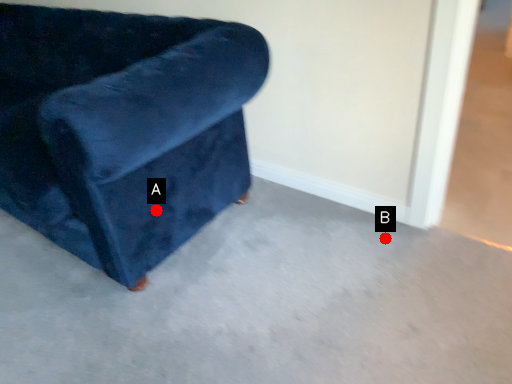
Question: Two points are circled on the image, labeled by A and B beside each circle. Which point is closer to the camera taking this photo?

Choices:
 (A) A is closer
 (B) B is closer

Answer: (A)